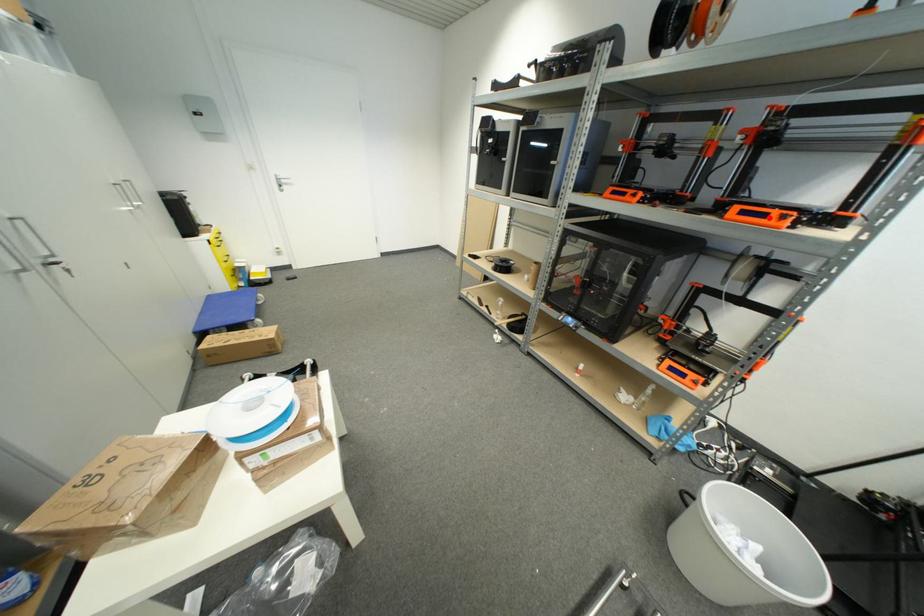
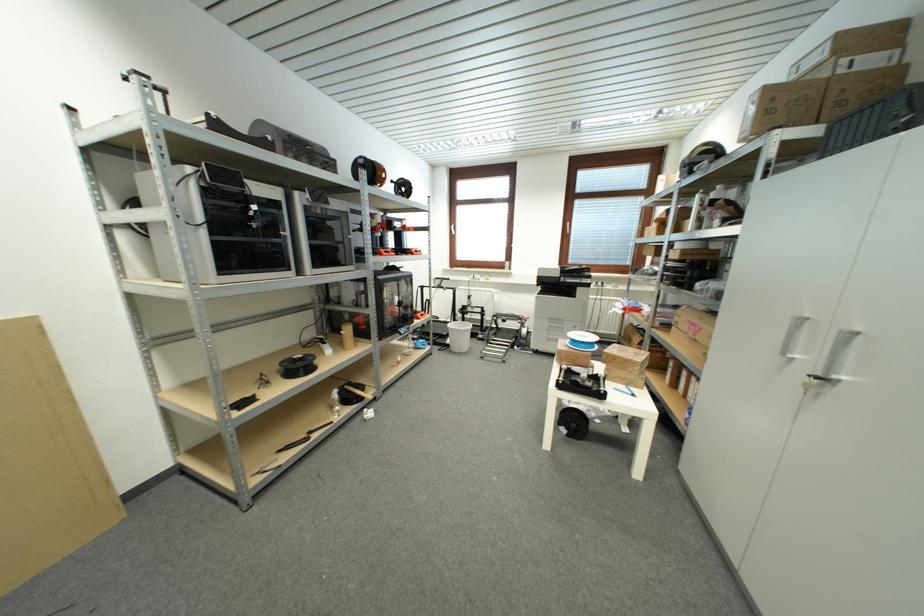
Where in the second image is the point corresponding to the highlighted location from the first image?

(422, 254)